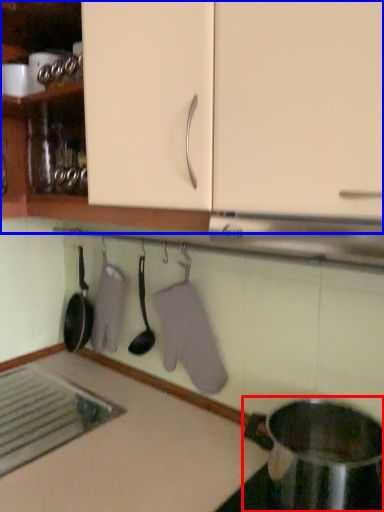
Question: Which object is further to the camera taking this photo, appliance (highlighted by a red box) or cabinetry (highlighted by a blue box)?

Choices:
 (A) appliance
 (B) cabinetry

Answer: (A)